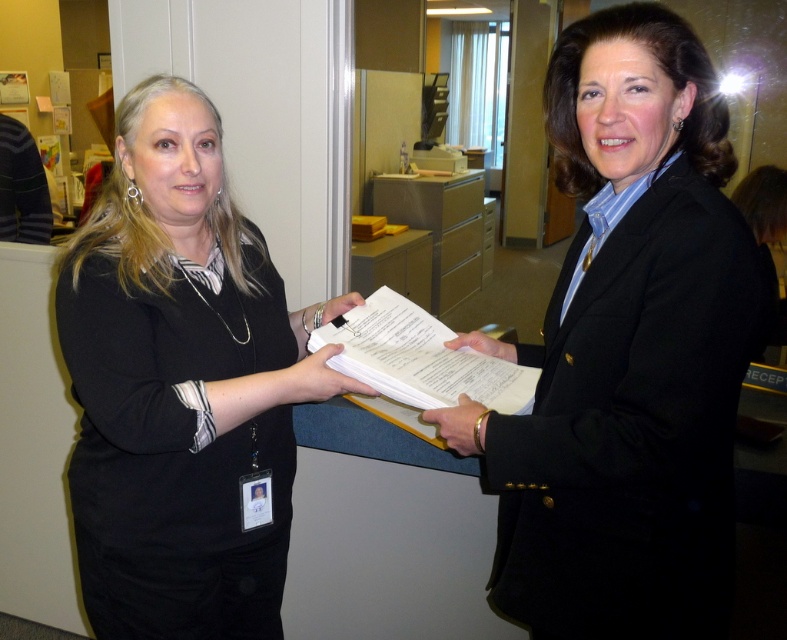
You are a photographer standing at the camera position. You want to take a photo of the black matte blazer at center. Can you reach it with your 36 inch long extendable pole?

The black matte blazer at center and camera are 36.18 inches apart from each other, so the 36 inch long extendable pole is slightly too short to reach the black matte blazer at center.

You are an office assistant who needs to hand over a document to the manager. The manager is wearing a black matte blazer at center and a matte black shirt at center. Which item of clothing is closer to you when you approach them?

The black matte blazer at center is closer to the viewer than the matte black shirt at center, so the black matte blazer at center would be closer to you when you approach them.

You are standing in an office and see two women. The woman on the left is handing over a stack of papers to the woman on the right. There is a point at coordinates (627, 353). What object is located at that point?

The point at coordinates (627, 353) corresponds to the black matte blazer at center.